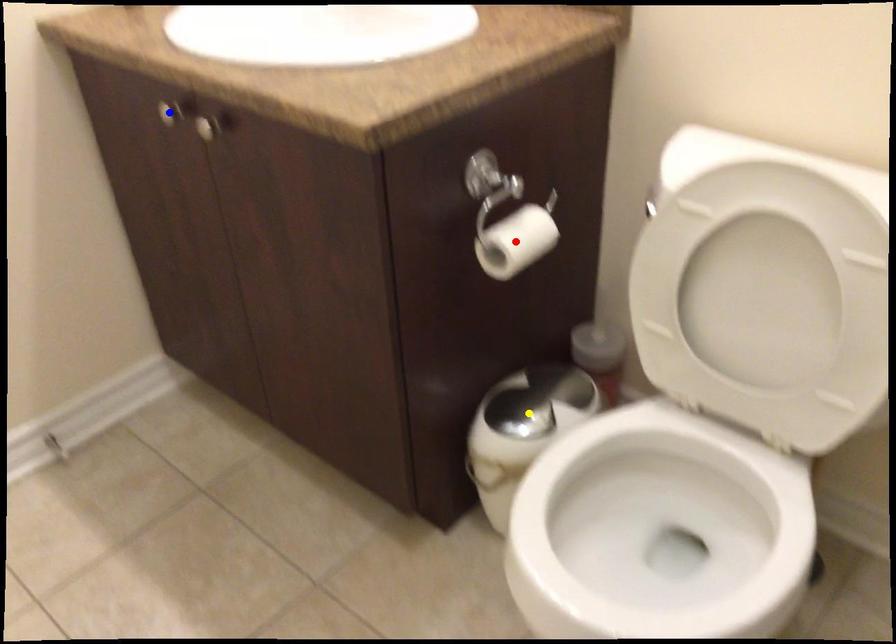
From the picture: Order these from farthest to nearest:
- blue point
- yellow point
- red point

yellow point
blue point
red point